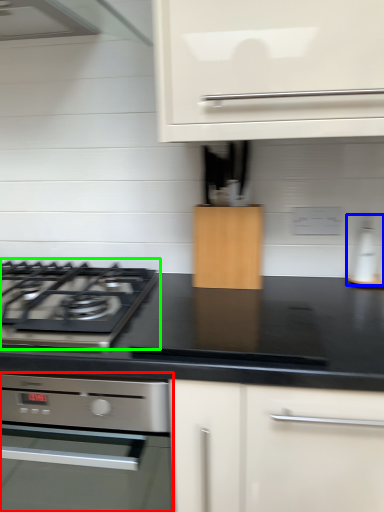
Question: Which is farther away from home appliance (highlighted by a red box)? kitchen appliance (highlighted by a blue box) or gas stove (highlighted by a green box)?

Choices:
 (A) kitchen appliance
 (B) gas stove

Answer: (A)